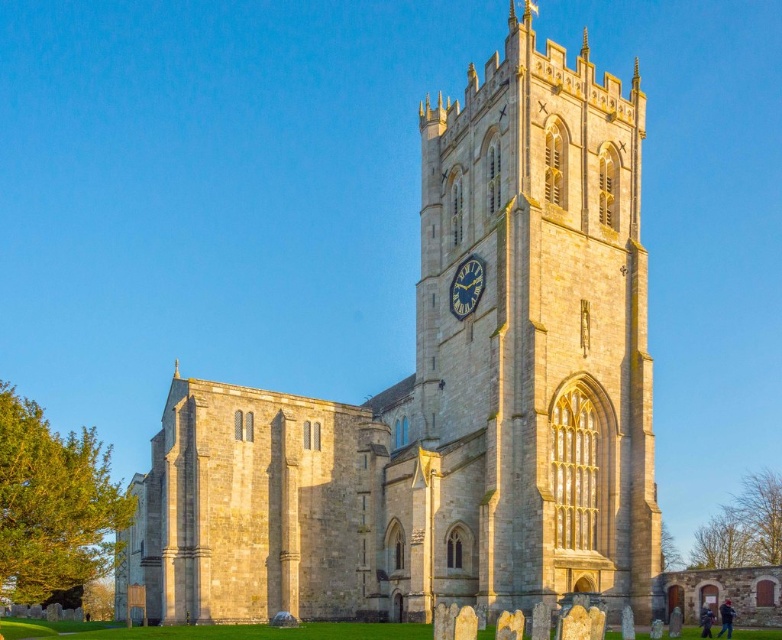
Question: Which object appears farthest from the camera in this image?

Choices:
 (A) stone clock tower at center
 (B) stone church at center
 (C) matte stone clock at center

Answer: (C)

Question: Observing the image, what is the correct spatial positioning of stone church at center in reference to matte stone clock at center?

Choices:
 (A) above
 (B) below

Answer: (A)

Question: Estimate the real-world distances between objects in this image. Which object is closer to the stone clock tower at center?

Choices:
 (A) stone church at center
 (B) matte stone clock at center

Answer: (A)

Question: Which point is closer to the camera?

Choices:
 (A) (456, 380)
 (B) (479, 292)

Answer: (B)

Question: Can you confirm if stone clock tower at center is positioned to the left of matte stone clock at center?

Choices:
 (A) yes
 (B) no

Answer: (B)

Question: Can you confirm if stone clock tower at center is thinner than matte stone clock at center?

Choices:
 (A) no
 (B) yes

Answer: (A)